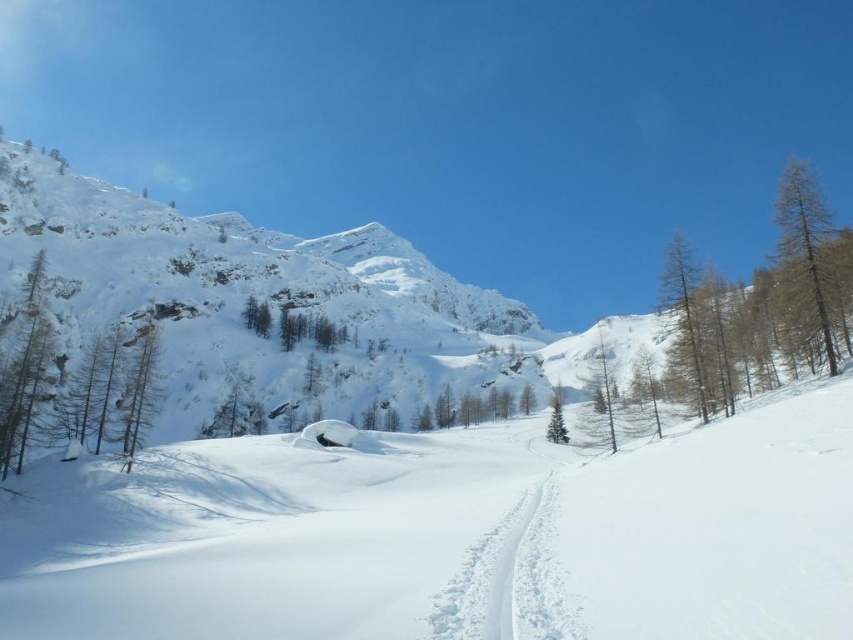
Can you confirm if brown wood tree at right is positioned to the right of smooth brown tree trunk at left?

Yes, brown wood tree at right is to the right of smooth brown tree trunk at left.

Between brown wood tree at right and smooth brown tree trunk at left, which one appears on the right side from the viewer's perspective?

Positioned to the right is brown wood tree at right.

The image size is (853, 640). What do you see at coordinates (746, 317) in the screenshot?
I see `brown wood tree at right` at bounding box center [746, 317].

What are the coordinates of `brown wood tree at right` in the screenshot? It's located at (746, 317).

Which is more to the right, smooth brown tree trunk at left or green matte tree at left?

smooth brown tree trunk at left

Is smooth brown tree trunk at left bigger than green matte tree at left?

Indeed, smooth brown tree trunk at left has a larger size compared to green matte tree at left.

Is point (57, 401) positioned after point (44, 301)?

No, (57, 401) is in front of (44, 301).

This screenshot has width=853, height=640. In order to click on smooth brown tree trunk at left in this screenshot , I will do `click(70, 384)`.

Which is behind, point (0, 381) or point (148, 412)?

Positioned behind is point (148, 412).

Which is more to the right, green matte tree at left or brown wood tree at lower left?

brown wood tree at lower left is more to the right.

Measure the distance between point (33, 356) and camera.

A distance of 119.95 meters exists between point (33, 356) and camera.

What are the coordinates of `green matte tree at left` in the screenshot? It's located at (24, 365).